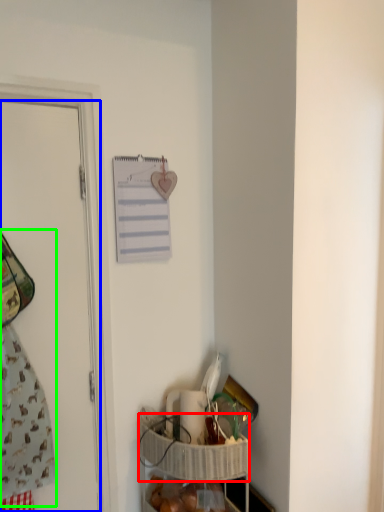
Question: Which object is positioned closest to basket (highlighted by a red box)? Select from door (highlighted by a blue box) and laundry (highlighted by a green box).

Choices:
 (A) door
 (B) laundry

Answer: (A)